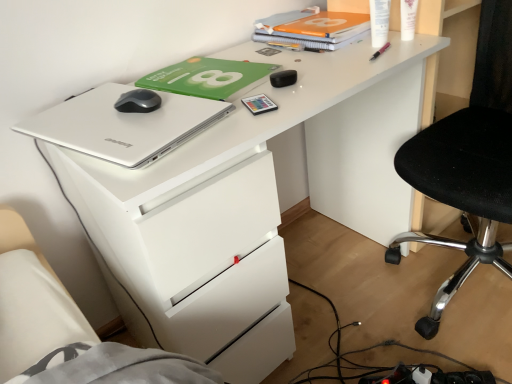
You are a GUI agent. You are given a task and a screenshot of the screen. Output one action in this format:
    pyautogui.click(x=<x>, y=<y>)
    Task: Click on the vacant region to the left of white plastic bottle at upper right, acting as the second stationery starting from the right
    This screenshot has height=384, width=512.
    Given the screenshot: What is the action you would take?
    pyautogui.click(x=322, y=54)